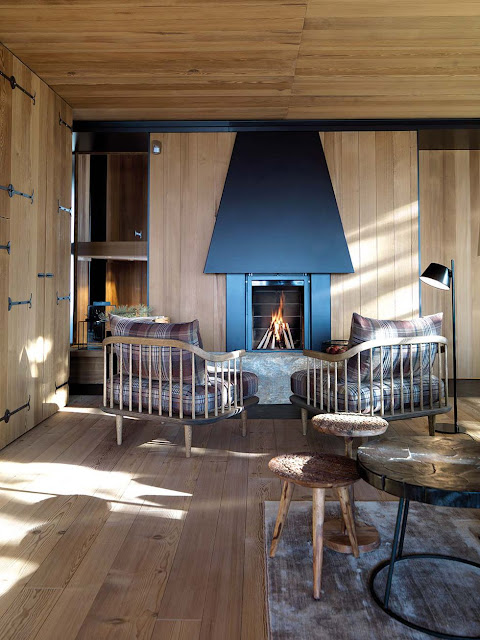
You are a GUI agent. You are given a task and a screenshot of the screen. Output one action in this format:
    pyautogui.click(x=<x>, y=<y>)
    Task: Click on the empty wall space to left  of fire place
    This screenshot has height=640, width=480.
    Given the screenshot: What is the action you would take?
    pyautogui.click(x=187, y=214)